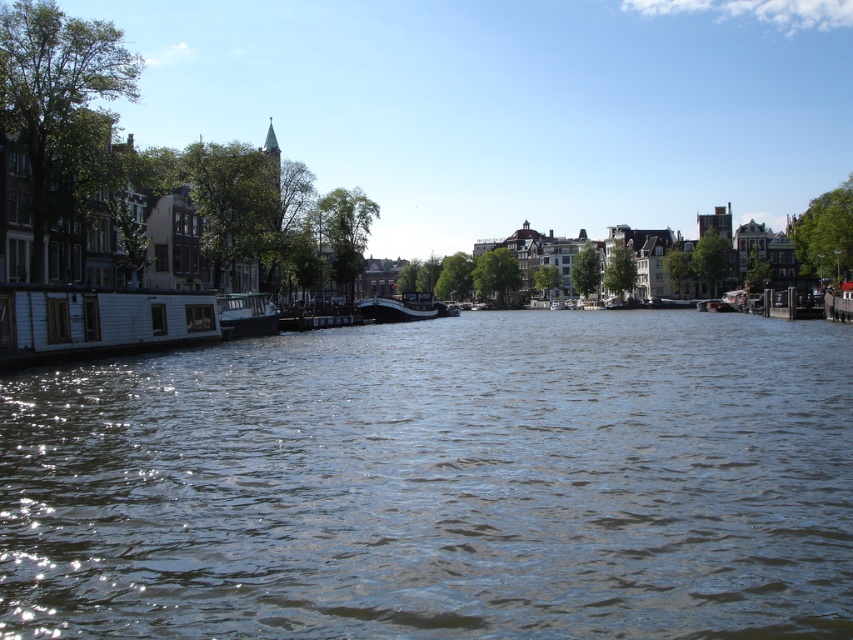
You are a tourist standing on the dock and want to take a photo of the white glossy boat at left and the brown water at center. Which object should you focus on first if you want to capture both in one frame without moving the camera?

The white glossy boat at left is to the left of the brown water at center, so you should focus on the white glossy boat at left first to ensure both are in frame.

You are a photographer planning to capture the canal scene. You want to ensure that the brown water at center and the white glossy boat at left are both clearly visible in your shot. Based on their sizes, which object should you prioritize framing closer to the center of the image to maintain balance?

The brown water at center should be prioritized closer to the center of the image because its width is larger than the white glossy boat at left, making it a more dominant element in the scene.